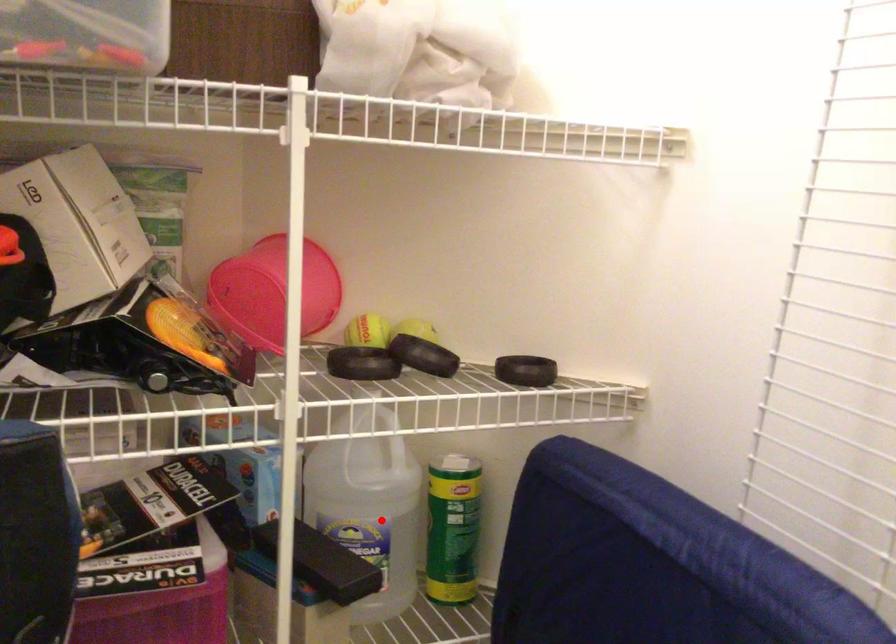
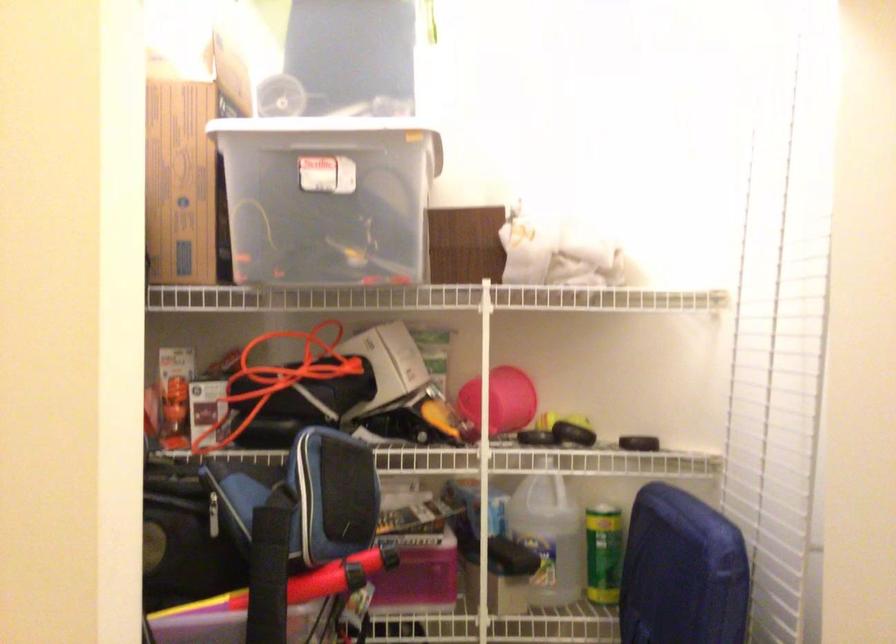
In the second image, find the point that corresponds to the highlighted location in the first image.

(548, 536)